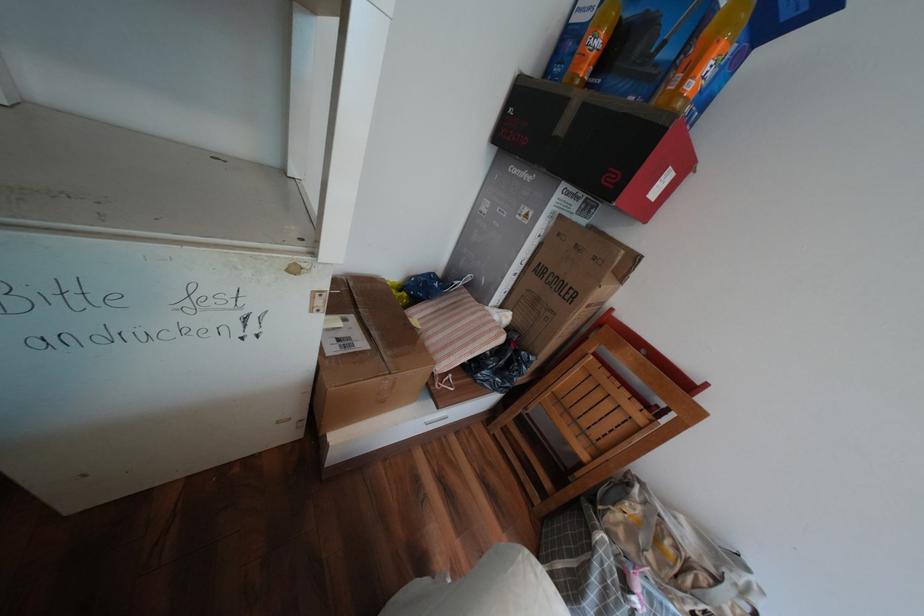
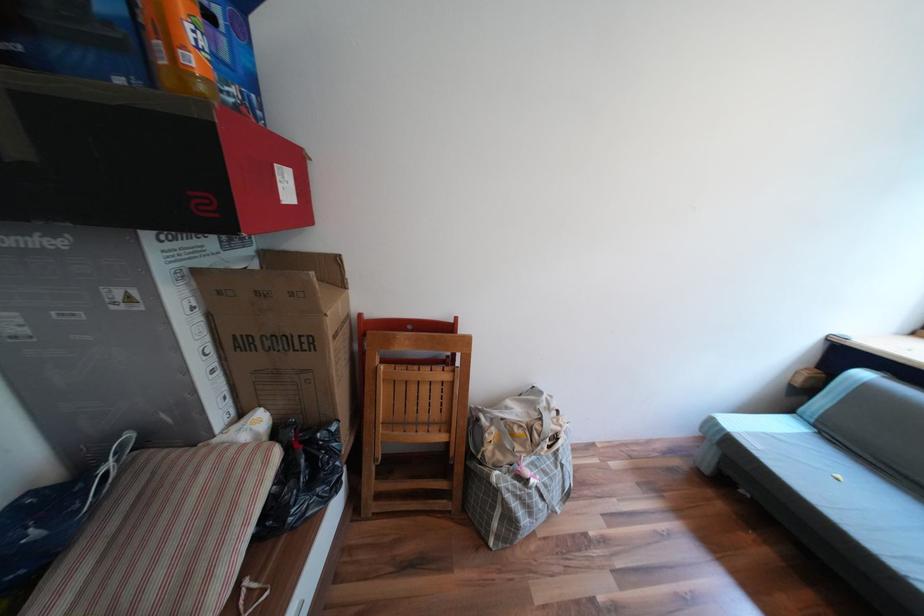
In the second image, find the point that corresponds to [666,184] in the first image.

(289, 185)